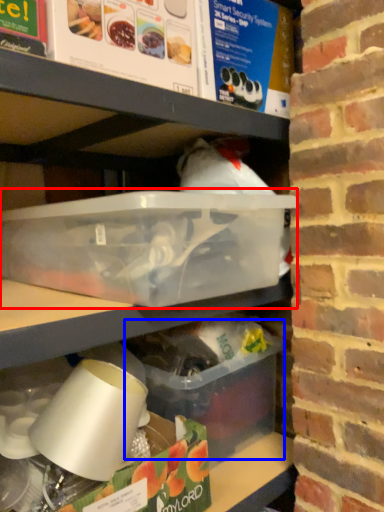
Question: Which object is closer to the camera taking this photo, box (highlighted by a red box) or box (highlighted by a blue box)?

Choices:
 (A) box
 (B) box

Answer: (A)